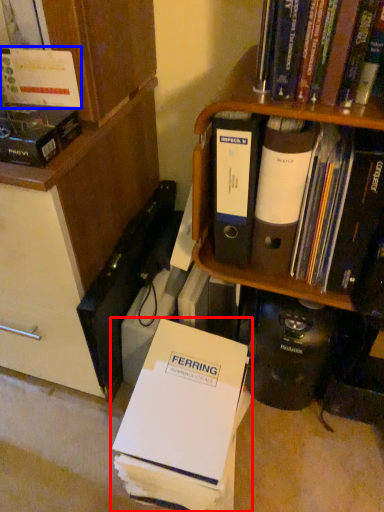
Question: Among these objects, which one is farthest to the camera, book (highlighted by a red box) or book (highlighted by a blue box)?

Choices:
 (A) book
 (B) book

Answer: (A)